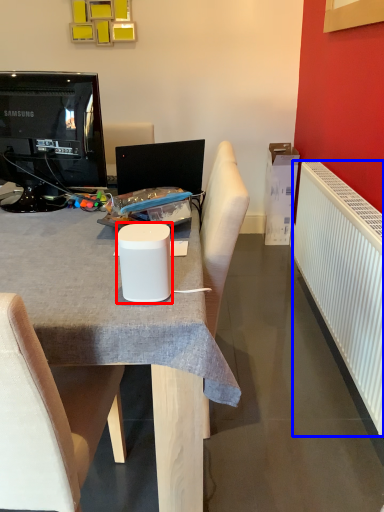
Question: Which of the following is the closest to the observer, paper cup (highlighted by a red box) or radiator (highlighted by a blue box)?

Choices:
 (A) paper cup
 (B) radiator

Answer: (A)